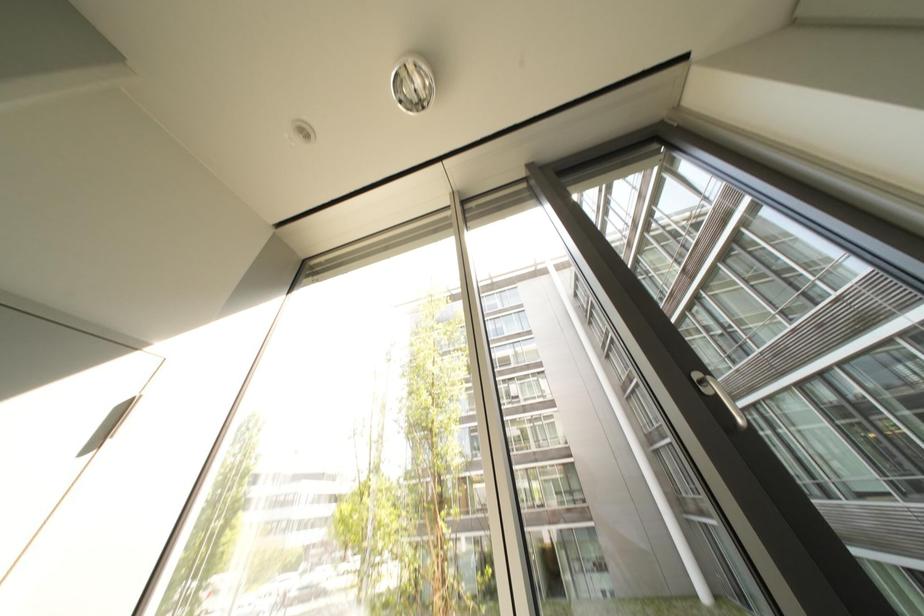
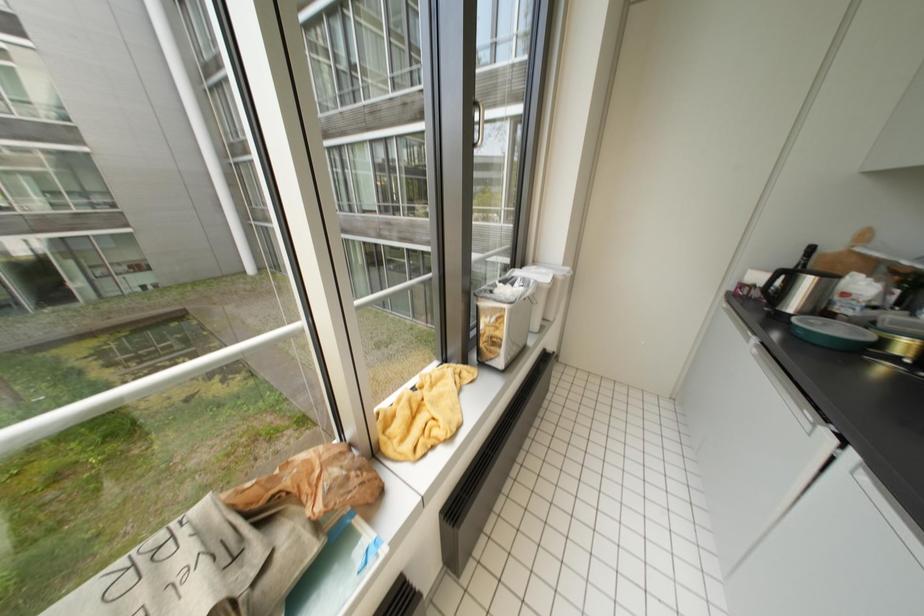
Looking at this image, based on the continuous images, in which direction is the camera rotating?

The rotation direction of the camera is right-down.